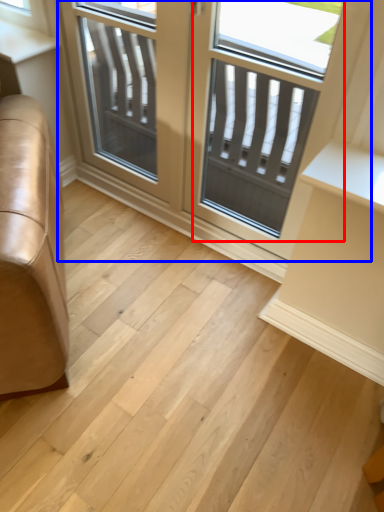
Question: Which of the following is the closest to the observer, screen door (highlighted by a red box) or window (highlighted by a blue box)?

Choices:
 (A) screen door
 (B) window

Answer: (A)